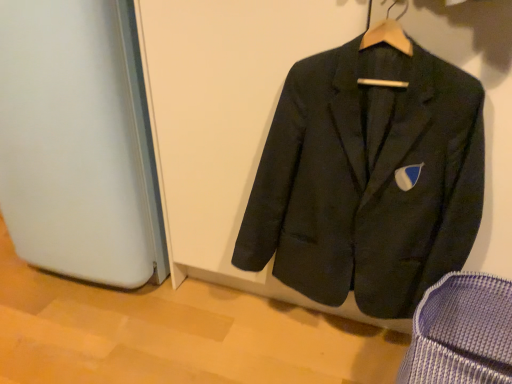
Question: Could you tell me if textured blue fabric armchair at lower right is turned towards matte black suit at center?

Choices:
 (A) yes
 (B) no

Answer: (B)

Question: From the image's perspective, is textured blue fabric armchair at lower right below matte black suit at center?

Choices:
 (A) no
 (B) yes

Answer: (B)

Question: Is textured blue fabric armchair at lower right positioned in front of matte black suit at center?

Choices:
 (A) no
 (B) yes

Answer: (B)

Question: From a real-world perspective, is textured blue fabric armchair at lower right physically below matte black suit at center?

Choices:
 (A) yes
 (B) no

Answer: (A)

Question: From a real-world perspective, is textured blue fabric armchair at lower right over matte black suit at center?

Choices:
 (A) no
 (B) yes

Answer: (A)

Question: Considering the relative sizes of textured blue fabric armchair at lower right and matte black suit at center in the image provided, is textured blue fabric armchair at lower right bigger than matte black suit at center?

Choices:
 (A) no
 (B) yes

Answer: (A)

Question: Can you confirm if matte black suit at center is wider than textured blue fabric armchair at lower right?

Choices:
 (A) no
 (B) yes

Answer: (A)

Question: From a real-world perspective, is matte black suit at center on textured blue fabric armchair at lower right?

Choices:
 (A) yes
 (B) no

Answer: (A)

Question: Does matte black suit at center have a greater height compared to textured blue fabric armchair at lower right?

Choices:
 (A) yes
 (B) no

Answer: (A)

Question: Is matte black suit at center closer to camera compared to textured blue fabric armchair at lower right?

Choices:
 (A) yes
 (B) no

Answer: (B)

Question: Can you confirm if matte black suit at center is shorter than textured blue fabric armchair at lower right?

Choices:
 (A) yes
 (B) no

Answer: (B)

Question: Is matte black suit at center completely or partially outside of textured blue fabric armchair at lower right?

Choices:
 (A) no
 (B) yes

Answer: (B)

Question: Considering the positions of matte black suit at center and textured blue fabric armchair at lower right in the image, is matte black suit at center wider or thinner than textured blue fabric armchair at lower right?

Choices:
 (A) thin
 (B) wide

Answer: (A)